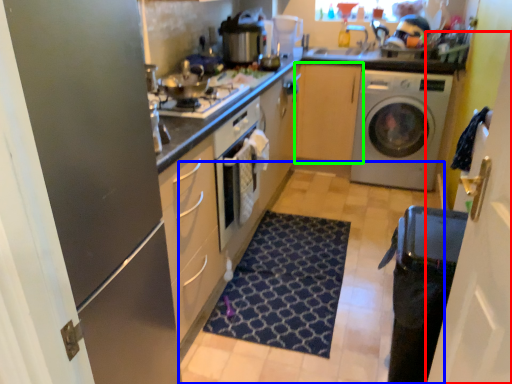
Question: Which object is positioned closest to glass door (highlighted by a red box)? Select from plain (highlighted by a blue box) and cabinetry (highlighted by a green box).

Choices:
 (A) plain
 (B) cabinetry

Answer: (A)